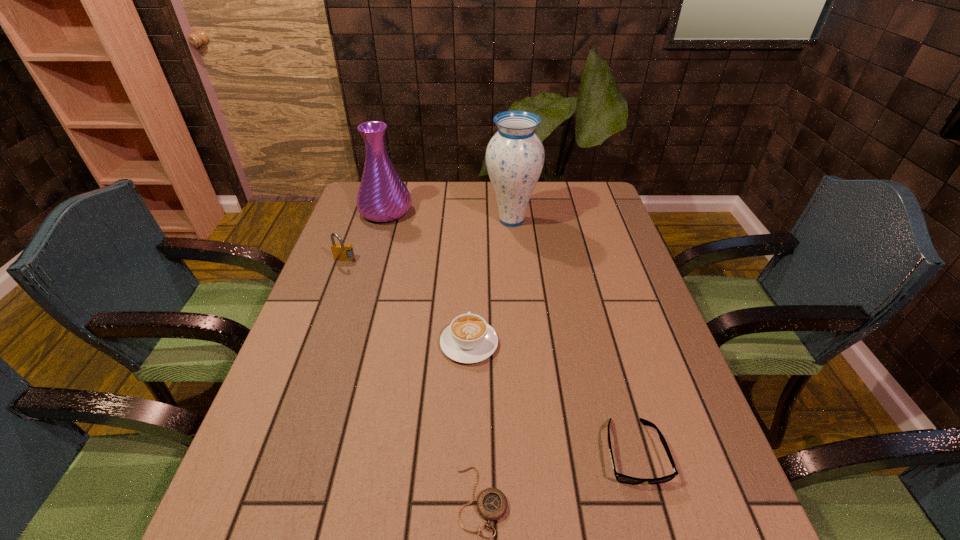
Locate an element on the screen. object situated at the right edge is located at coordinates (621, 478).

At what (x,y) coordinates should I click in order to perform the action: click on object that is at the far left corner. Please return your answer as a coordinate pair (x, y). This screenshot has height=540, width=960. Looking at the image, I should click on (382, 196).

Where is `free location at the far edge of the desktop`? This screenshot has height=540, width=960. free location at the far edge of the desktop is located at coordinates (437, 185).

Locate an element on the screen. This screenshot has width=960, height=540. vacant region at the left edge is located at coordinates (285, 420).

The image size is (960, 540). I want to click on vacant region at the right edge of the desktop, so [x=669, y=495].

Identify the location of free space at the far right corner of the desktop. Image resolution: width=960 pixels, height=540 pixels. (593, 204).

You are a GUI agent. You are given a task and a screenshot of the screen. Output one action in this format:
    pyautogui.click(x=<x>, y=<y>)
    Task: Click on the vacant region between the fourth shortest object and the right vase
    This screenshot has width=960, height=540.
    Given the screenshot: What is the action you would take?
    pyautogui.click(x=428, y=240)

The image size is (960, 540). Find the location of `vacant area that lies between the left vase and the third shortest object`. vacant area that lies between the left vase and the third shortest object is located at coordinates (427, 278).

At what (x,y) coordinates should I click in order to perform the action: click on vacant point located between the fourth tallest object and the shortest object. Please return your answer as a coordinate pair (x, y). This screenshot has height=540, width=960. Looking at the image, I should click on (475, 422).

Where is `unoccupied position between the cappuccino and the right vase`? unoccupied position between the cappuccino and the right vase is located at coordinates (491, 282).